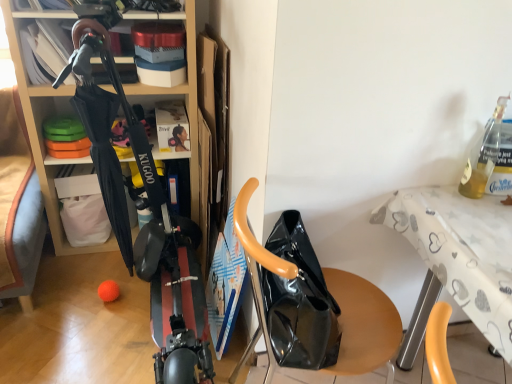
Question: From a real-world perspective, is translucent glass bottle at upper right above or below glossy black bag at center?

Choices:
 (A) below
 (B) above

Answer: (B)

Question: Considering their positions, is translucent glass bottle at upper right located in front of or behind glossy black bag at center?

Choices:
 (A) front
 (B) behind

Answer: (B)

Question: Which object is the farthest from the white printed fabric table at upper right?

Choices:
 (A) translucent glass bottle at upper right
 (B) matte black umbrella at left
 (C) black glossy scooter at center
 (D) glossy black bag at center

Answer: (B)

Question: Which object is positioned farthest from the matte black umbrella at left?

Choices:
 (A) translucent glass bottle at upper right
 (B) white printed fabric table at upper right
 (C) black glossy scooter at center
 (D) glossy black bag at center

Answer: (A)